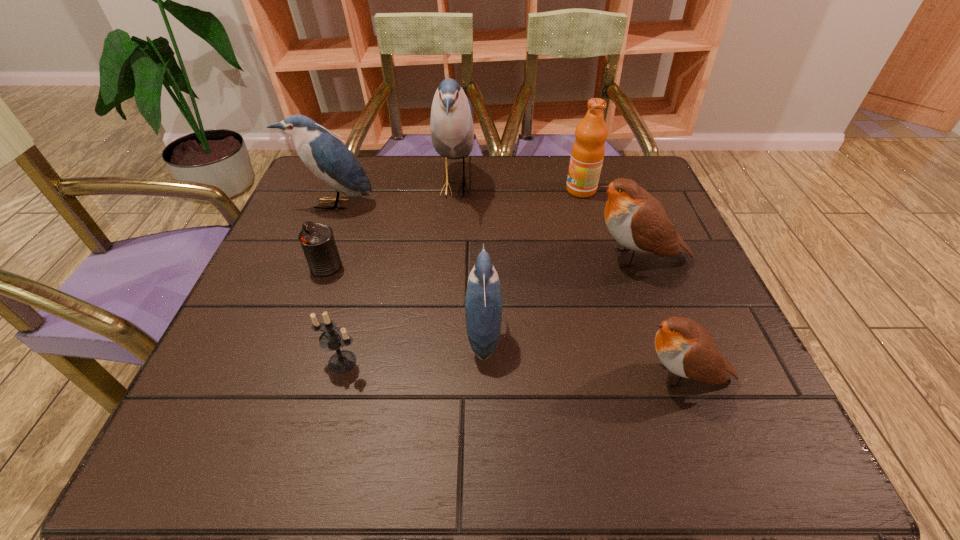
Where is `vacant space situated 0.390m at the tip of the nearest blue bird's beak`? This screenshot has width=960, height=540. vacant space situated 0.390m at the tip of the nearest blue bird's beak is located at coordinates (263, 333).

Find the location of `free space located 0.140m at the tip of the nearest blue bird's beak`. free space located 0.140m at the tip of the nearest blue bird's beak is located at coordinates (394, 333).

This screenshot has width=960, height=540. Find the location of `vacant space situated at the tip of the nearest blue bird's beak`. vacant space situated at the tip of the nearest blue bird's beak is located at coordinates (278, 333).

Locate an element on the screen. The height and width of the screenshot is (540, 960). vacant space positioned 0.180m at the face of the shortest bird is located at coordinates (530, 376).

You are a GUI agent. You are given a task and a screenshot of the screen. Output one action in this format:
    pyautogui.click(x=<x>, y=<y>)
    Task: Click on the free spot located at the face of the shortest bird
    The height and width of the screenshot is (540, 960).
    Given the screenshot: What is the action you would take?
    pyautogui.click(x=439, y=376)

Where is `vacant space located 0.200m at the face of the shortest bird`? vacant space located 0.200m at the face of the shortest bird is located at coordinates (518, 376).

At what (x,y) coordinates should I click in order to perform the action: click on free space located on the back of the candle holder. Please return your answer as a coordinate pair (x, y). Looking at the image, I should click on (358, 302).

Where is `blank space located on the right of the can`? The height and width of the screenshot is (540, 960). blank space located on the right of the can is located at coordinates pos(414,266).

Identify the location of fruit juice present at the far edge. (588, 150).

I want to click on bird that is positioned at the left edge, so click(327, 157).